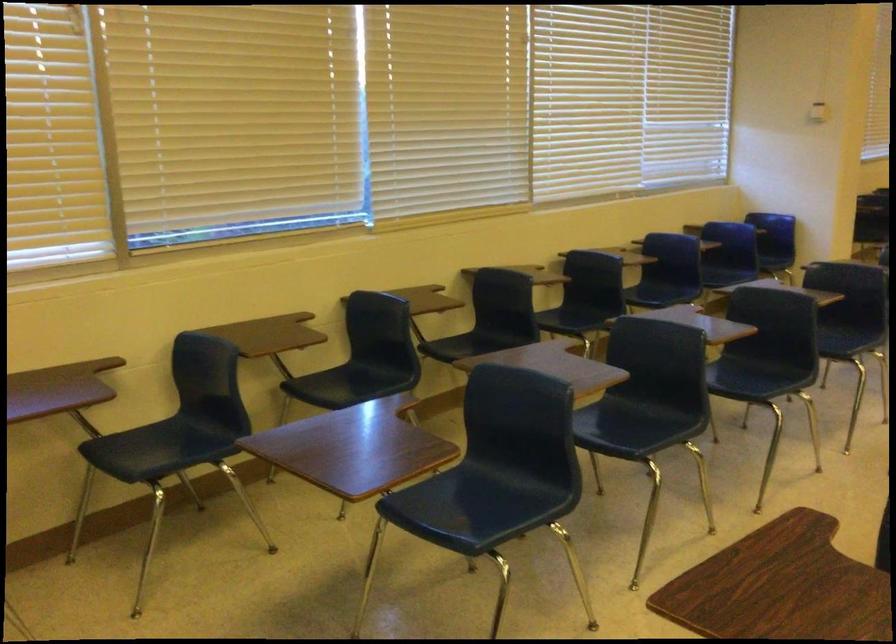
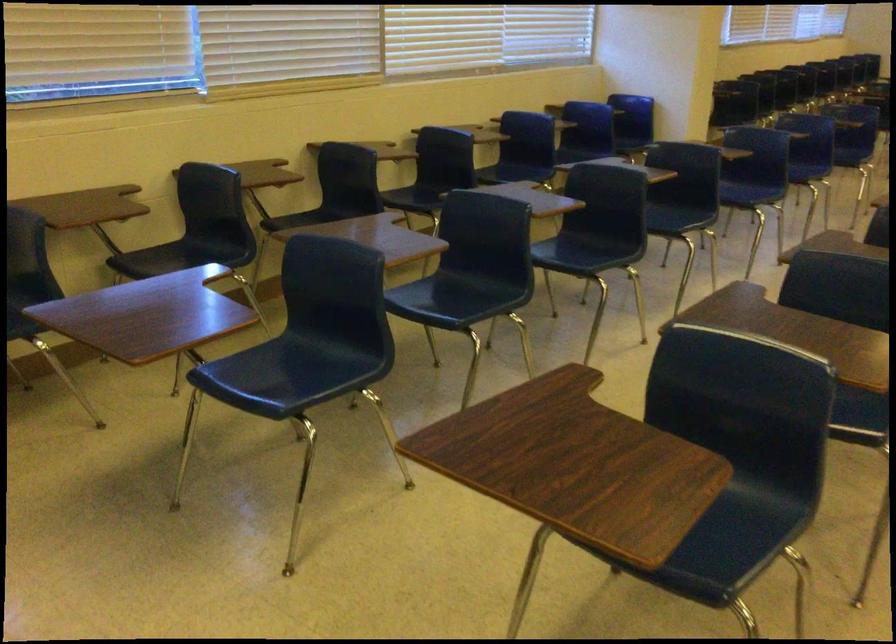
In the second image, find the point that corresponds to (x=348, y=377) in the first image.

(181, 257)